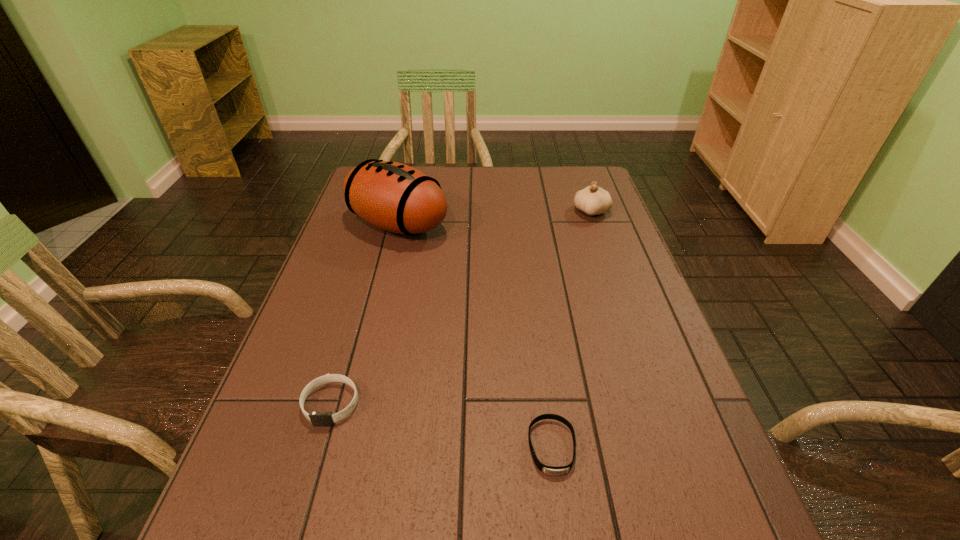
Locate an element on the screen. Image resolution: width=960 pixels, height=540 pixels. football (American) is located at coordinates (392, 196).

At what (x,y) coordinates should I click in order to perform the action: click on garlic. Please return your answer as a coordinate pair (x, y). Looking at the image, I should click on (593, 200).

The width and height of the screenshot is (960, 540). Identify the location of the third shortest object. (593, 200).

The image size is (960, 540). I want to click on the third tallest object, so click(317, 418).

The image size is (960, 540). What are the coordinates of `the taller wristband` in the screenshot? It's located at (317, 418).

Identify the location of the shortest object. (550, 470).

Locate an element on the screen. The width and height of the screenshot is (960, 540). the right wristband is located at coordinates (550, 470).

Find the location of a particular element. This screenshot has height=540, width=960. vacant space situated on the right of the football (American) is located at coordinates [477, 224].

Where is `blank space located on the back of the rightmost object`? blank space located on the back of the rightmost object is located at coordinates (575, 167).

Find the location of a particular element. free space located 0.120m on the outer surface of the left wristband is located at coordinates (305, 493).